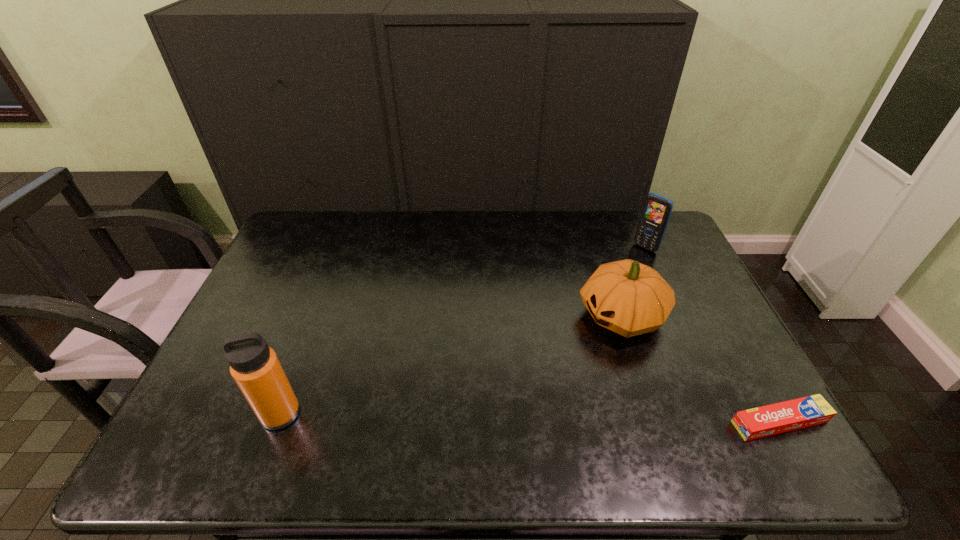
Identify the location of the tallest object. (255, 367).

Image resolution: width=960 pixels, height=540 pixels. In order to click on the leftmost object in this screenshot , I will do `click(255, 367)`.

The image size is (960, 540). I want to click on toothpaste, so click(x=768, y=420).

This screenshot has width=960, height=540. I want to click on gourd, so click(x=629, y=298).

The image size is (960, 540). I want to click on the farthest object, so click(x=657, y=209).

Find the location of a particular element. free space located 0.080m on the left of the thermos bottle is located at coordinates (228, 414).

The image size is (960, 540). In order to click on vacant space situated on the left of the shortest object in this screenshot , I will do `click(688, 422)`.

Locate an element on the screen. free space located 0.050m on the side of the gourd with the carved face is located at coordinates (577, 343).

This screenshot has height=540, width=960. Identify the location of free space located on the side of the gourd with the carved face. (494, 394).

Where is `vacant point located 0.370m on the side of the gourd with the carved face`? vacant point located 0.370m on the side of the gourd with the carved face is located at coordinates (481, 402).